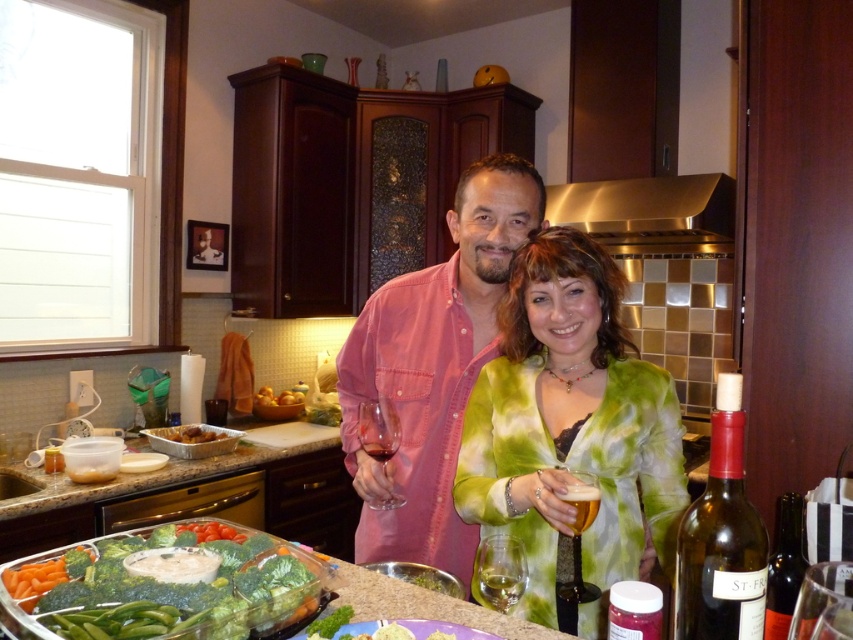
Is stainless steel exhaust hood at upper center in front of translucent glass beer at center?

No, it is not.

Describe the element at coordinates (647, 209) in the screenshot. Image resolution: width=853 pixels, height=640 pixels. I see `stainless steel exhaust hood at upper center` at that location.

Identify the location of stainless steel exhaust hood at upper center. (647, 209).

Can you confirm if green silk blouse at center is positioned above stainless steel exhaust hood at upper center?

No.

Is green silk blouse at center in front of stainless steel exhaust hood at upper center?

Yes, green silk blouse at center is closer to the viewer.

Does point (451, 492) come in front of point (645, 218)?

Yes, point (451, 492) is closer to viewer.

Locate an element on the screen. This screenshot has width=853, height=640. green silk blouse at center is located at coordinates click(x=572, y=429).

Which of these two, transparent glass at center or translucent glass beer at center, stands taller?

transparent glass at center is taller.

Find the location of a particular element. This screenshot has height=640, width=853. transparent glass at center is located at coordinates (379, 429).